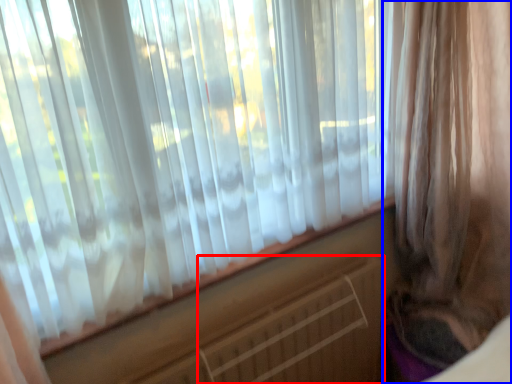
Question: Which of the following is the closest to the observer, radiator (highlighted by a red box) or curtain (highlighted by a blue box)?

Choices:
 (A) radiator
 (B) curtain

Answer: (B)